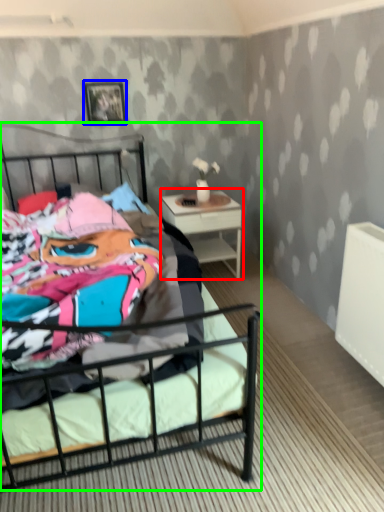
Question: Based on their relative distances, which object is nearer to nightstand (highlighted by a red box)? Choose from picture frame (highlighted by a blue box) and bed (highlighted by a green box).

Choices:
 (A) picture frame
 (B) bed

Answer: (B)